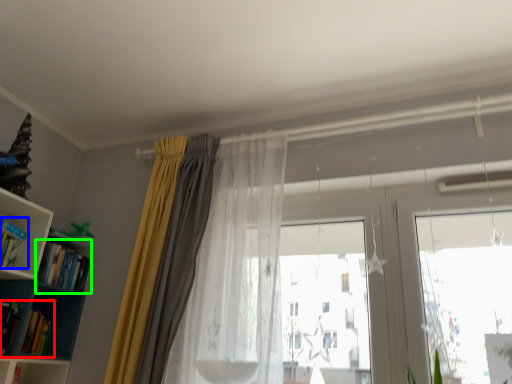
Question: Which object is the farthest from book (highlighted by a red box)? Choose among these: book (highlighted by a blue box) or book (highlighted by a green box).

Choices:
 (A) book
 (B) book

Answer: (A)